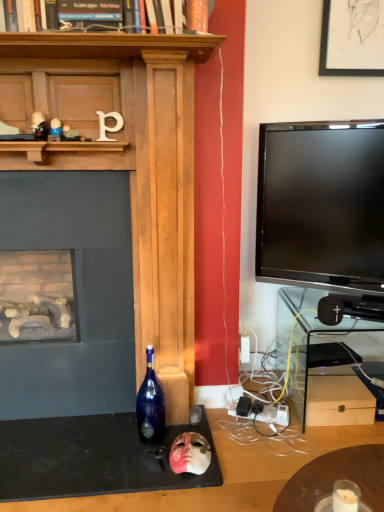
This screenshot has height=512, width=384. Find the location of `clear glass shelf at right`. clear glass shelf at right is located at coordinates (335, 371).

What do you see at coordinates (335, 371) in the screenshot?
I see `clear glass shelf at right` at bounding box center [335, 371].

You are a GUI agent. You are given a task and a screenshot of the screen. Output one action in this format:
    pyautogui.click(x=<x>, y=<y>)
    Task: Click on the metallic black figurine at upper left, the first toy from the top
    The width and height of the screenshot is (384, 512).
    Given the screenshot: What is the action you would take?
    (x=39, y=126)

Image resolution: width=384 pixels, height=512 pixels. Find the location of `blue glass bottle at center`. blue glass bottle at center is located at coordinates (150, 405).

You are a GUI agent. You are given a task and a screenshot of the screen. Output one action in this format:
    pyautogui.click(x=<x>, y=<y>)
    Task: Click on the plastic toy at upper left, which is the second toy from top to bottom
    Image resolution: width=384 pixels, height=512 pixels.
    Given the screenshot: What is the action you would take?
    pyautogui.click(x=55, y=130)

Which of these two, blue glass bottle at center or clear glass shelf at right, stands shorter?

blue glass bottle at center is shorter.

Looking at this image, from a real-world perspective, relative to clear glass shelf at right, is blue glass bottle at center vertically above or below?

blue glass bottle at center is situated higher than clear glass shelf at right in the real world.

Is blue glass bottle at center not inside clear glass shelf at right?

Absolutely, blue glass bottle at center is external to clear glass shelf at right.

From the image's perspective, which one is positioned higher, blue glass bottle at center or clear glass shelf at right?

clear glass shelf at right, from the image's perspective.

Locate an element on the screen. The width and height of the screenshot is (384, 512). toy that is the 2nd object directly below the metallic black figurine at upper left, which is the fourth toy in right-to-left order (from a real-world perspective) is located at coordinates (71, 134).

Does metallic black figurine at upper left, the fourth toy ordered from the bottom, have a lesser height compared to metallic silver toy at upper center, the 3th toy in the left-to-right sequence?

In fact, metallic black figurine at upper left, the fourth toy ordered from the bottom, may be taller than metallic silver toy at upper center, the 3th toy in the left-to-right sequence.

Is metallic silver toy at upper center, the 3th toy in the left-to-right sequence, surrounded by metallic black figurine at upper left, which is the fourth toy in right-to-left order?

That's incorrect, metallic silver toy at upper center, the 3th toy in the left-to-right sequence, is not inside metallic black figurine at upper left, which is the fourth toy in right-to-left order.

Looking at this image, is metallic black figurine at upper left, the fourth toy ordered from the bottom, bigger or smaller than metallic silver toy at upper center, acting as the 2th toy starting from the right?

Clearly, metallic black figurine at upper left, the fourth toy ordered from the bottom, is larger in size than metallic silver toy at upper center, acting as the 2th toy starting from the right.

From a real-world perspective, is white matte letter p at upper center over blue glass bottle at center?

Yes.

Find the location of `bottle that is on the right side of white matte letter p at upper center`. bottle that is on the right side of white matte letter p at upper center is located at coordinates (150, 405).

Considering the sizes of objects white matte letter p at upper center and blue glass bottle at center in the image provided, who is taller, white matte letter p at upper center or blue glass bottle at center?

blue glass bottle at center is taller.

Is white matte letter p at upper center aimed at blue glass bottle at center?

No, white matte letter p at upper center does not turn towards blue glass bottle at center.

Does black matte speaker at lower right have a smaller size compared to metallic silver toy at upper center, the 3th toy in the left-to-right sequence?

No, black matte speaker at lower right is not smaller than metallic silver toy at upper center, the 3th toy in the left-to-right sequence.

Identify the location of the 4th toy in front of the black matte speaker at lower right. The width and height of the screenshot is (384, 512). (71, 134).

Would you say black matte speaker at lower right is a long distance from metallic silver toy at upper center, acting as the 2th toy starting from the right?

Yes, black matte speaker at lower right is far from metallic silver toy at upper center, acting as the 2th toy starting from the right.

Would you say black matte speaker at lower right is inside or outside metallic silver toy at upper center, the second toy ordered from the bottom?

black matte speaker at lower right is spatially situated outside metallic silver toy at upper center, the second toy ordered from the bottom.

From a real-world perspective, who is located lower, metallic black figurine at upper left, the fourth toy ordered from the bottom, or blue glass bottle at center?

blue glass bottle at center is physically lower.

Is metallic black figurine at upper left, the fourth toy ordered from the bottom, to the right of blue glass bottle at center from the viewer's perspective?

No.

Is metallic black figurine at upper left, the first toy from the top, facing towards blue glass bottle at center?

No, metallic black figurine at upper left, the first toy from the top, is not turned towards blue glass bottle at center.

From the image's perspective, is metallic black figurine at upper left, the first toy from the top, below blue glass bottle at center?

No, from the image's perspective, metallic black figurine at upper left, the first toy from the top, is not beneath blue glass bottle at center.

In the scene shown: Considering the positions of objects blue glass bottle at center and pink matte mask at lower center, the fourth toy viewed from the left, in the image provided, who is behind, blue glass bottle at center or pink matte mask at lower center, the fourth toy viewed from the left,?

Positioned behind is blue glass bottle at center.

Is point (149, 413) closer or farther from the camera than point (187, 440)?

Clearly, point (149, 413) is more distant from the camera than point (187, 440).

Are blue glass bottle at center and pink matte mask at lower center, acting as the 1th toy starting from the bottom, located far from each other?

Actually, blue glass bottle at center and pink matte mask at lower center, acting as the 1th toy starting from the bottom, are a little close together.

At what (x,y) coordinates should I click in order to perform the action: click on toy below the blue glass bottle at center (from the image's perspective). Please return your answer as a coordinate pair (x, y). Image resolution: width=384 pixels, height=512 pixels. Looking at the image, I should click on (190, 454).

From a real-world perspective, who is located higher, pink matte mask at lower center, the fourth toy viewed from the left, or clear glass shelf at right?

In real-world perspective, clear glass shelf at right is above.

Is pink matte mask at lower center, the fourth toy viewed from the left, far from clear glass shelf at right?

No, pink matte mask at lower center, the fourth toy viewed from the left, is not far from clear glass shelf at right.

Is pink matte mask at lower center, acting as the 1th toy starting from the bottom, positioned behind clear glass shelf at right?

No, the depth of pink matte mask at lower center, acting as the 1th toy starting from the bottom, is less than that of clear glass shelf at right.

Find the location of a particular element. bottle that appears on the left of clear glass shelf at right is located at coordinates (150, 405).

From a real-world perspective, starting from the metallic silver toy at upper center, which ranks as the third toy in top-to-bottom order, which toy is the 2nd one vertically above it? Please provide its 2D coordinates.

[(39, 126)]

Based on their spatial positions, is clear glass shelf at right or black matte speaker at lower right closer to pink matte mask at lower center, the fourth toy viewed from the left?

Based on the image, clear glass shelf at right appears to be nearer to pink matte mask at lower center, the fourth toy viewed from the left.

Which object lies further to the anchor point metallic silver toy at upper center, which ranks as the third toy in top-to-bottom order, metallic black figurine at upper left, which is the fourth toy in right-to-left order, or black matte speaker at lower right?

Based on the image, black matte speaker at lower right appears to be further to metallic silver toy at upper center, which ranks as the third toy in top-to-bottom order.

From the image, which object appears to be nearer to metallic black figurine at upper left, the fourth toy ordered from the bottom, metallic silver toy at upper center, the second toy ordered from the bottom, or black matte speaker at lower right?

Among the two, metallic silver toy at upper center, the second toy ordered from the bottom, is located nearer to metallic black figurine at upper left, the fourth toy ordered from the bottom.

When comparing their distances from metallic black figurine at upper left, which is the fourth toy in right-to-left order, does plastic toy at upper left, which is the second toy from top to bottom, or white matte letter p at upper center seem closer?

plastic toy at upper left, which is the second toy from top to bottom, lies closer to metallic black figurine at upper left, which is the fourth toy in right-to-left order, than the other object.

From the image, which object appears to be nearer to plastic toy at upper left, which is the third toy from right to left, pink matte mask at lower center, the fourth toy viewed from the left, or blue glass bottle at center?

blue glass bottle at center lies closer to plastic toy at upper left, which is the third toy from right to left, than the other object.

Which object lies further to the anchor point plastic toy at upper left, which is the second toy from top to bottom, clear glass shelf at right or metallic silver toy at upper center, the 3th toy in the left-to-right sequence?

Based on the image, clear glass shelf at right appears to be further to plastic toy at upper left, which is the second toy from top to bottom.

Based on their spatial positions, is metallic silver toy at upper center, acting as the 2th toy starting from the right, or plastic toy at upper left, the second toy when ordered from left to right, further from pink matte mask at lower center, which appears as the fourth toy when viewed from the top?

plastic toy at upper left, the second toy when ordered from left to right, is further to pink matte mask at lower center, which appears as the fourth toy when viewed from the top.

Consider the image. Based on their spatial positions, is clear glass shelf at right or pink matte mask at lower center, which appears as the fourth toy when viewed from the top, further from plastic toy at upper left, acting as the third toy starting from the bottom?

clear glass shelf at right is further to plastic toy at upper left, acting as the third toy starting from the bottom.

Where is `toy between blue glass bottle at center and black matte speaker at lower right from left to right`? The height and width of the screenshot is (512, 384). toy between blue glass bottle at center and black matte speaker at lower right from left to right is located at coordinates (190, 454).

This screenshot has height=512, width=384. Identify the location of toy between metallic silver toy at upper center, which ranks as the third toy in top-to-bottom order, and clear glass shelf at right from left to right. (190, 454).

Identify the location of speaker between white matte letter p at upper center and blue glass bottle at center in the up-down direction. The image size is (384, 512). (330, 310).

Locate an element on the screen. The height and width of the screenshot is (512, 384). number between metallic silver toy at upper center, the second toy ordered from the bottom, and black matte speaker at lower right, in the horizontal direction is located at coordinates (109, 127).